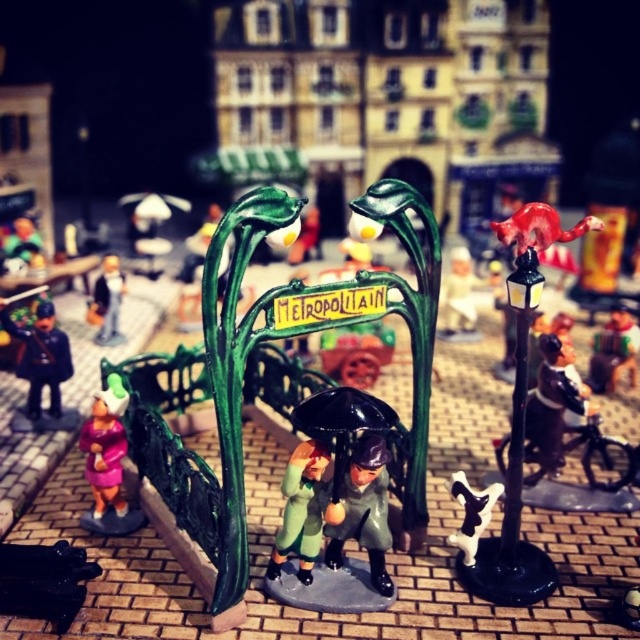
Which is above, matte green coat at center or shiny black uniform at left?

Positioned higher is shiny black uniform at left.

Is matte green coat at center bigger than shiny black uniform at left?

Incorrect, matte green coat at center is not larger than shiny black uniform at left.

Describe the element at coordinates (364, 509) in the screenshot. I see `matte green coat at center` at that location.

This screenshot has height=640, width=640. I want to click on matte green coat at center, so click(x=364, y=509).

Does shiny black umbrella at center have a smaller size compared to matte green umbrella at center?

No.

Does shiny black umbrella at center have a lesser height compared to matte green umbrella at center?

In fact, shiny black umbrella at center may be taller than matte green umbrella at center.

Between point (328, 403) and point (314, 452), which one is positioned behind?

The point (314, 452) is more distant.

Locate an element on the screen. shiny black umbrella at center is located at coordinates (337, 504).

Locate an element on the screen. shiny black umbrella at center is located at coordinates (337, 504).

Consider the image. Is shiny black umbrella at center thinner than matte gray figure at left?

No, shiny black umbrella at center is not thinner than matte gray figure at left.

Image resolution: width=640 pixels, height=640 pixels. I want to click on shiny black umbrella at center, so click(337, 504).

The height and width of the screenshot is (640, 640). I want to click on shiny black umbrella at center, so click(337, 504).